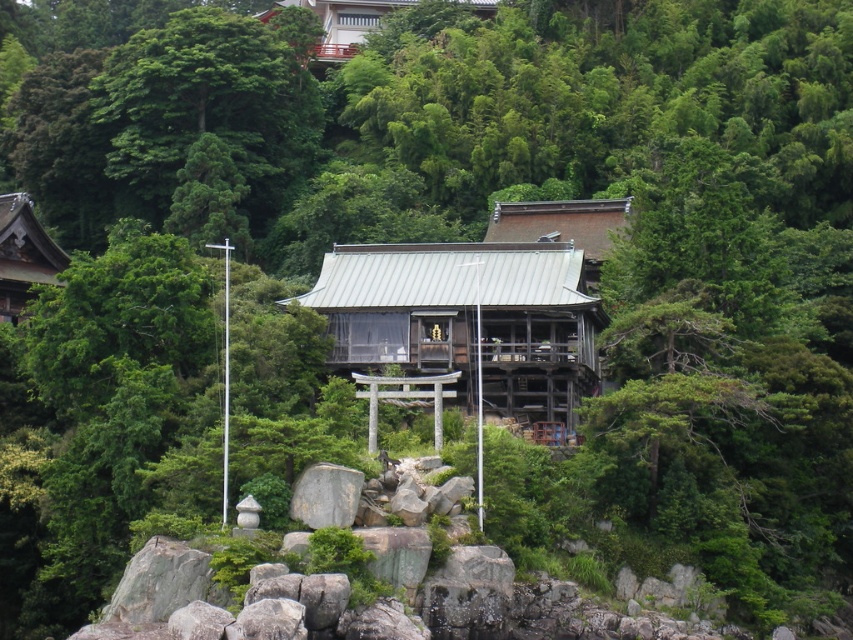
Question: Can you confirm if green wooden hut at center is positioned to the right of matte wooden shrine at upper left?

Choices:
 (A) no
 (B) yes

Answer: (B)

Question: Which point is farther to the camera?

Choices:
 (A) (326, 33)
 (B) (573, 424)
 (C) (15, 266)

Answer: (A)

Question: Can you confirm if green wooden hut at center is wider than matte wooden shrine at upper left?

Choices:
 (A) yes
 (B) no

Answer: (A)

Question: Which point appears closest to the camera in this image?

Choices:
 (A) (30, 202)
 (B) (490, 259)
 (C) (281, 3)

Answer: (B)

Question: Observing the image, what is the correct spatial positioning of green wooden hut at center in reference to matte wooden shrine at upper left?

Choices:
 (A) above
 (B) below

Answer: (B)

Question: Which point is farther to the camera?

Choices:
 (A) (25, 234)
 (B) (283, 3)

Answer: (B)